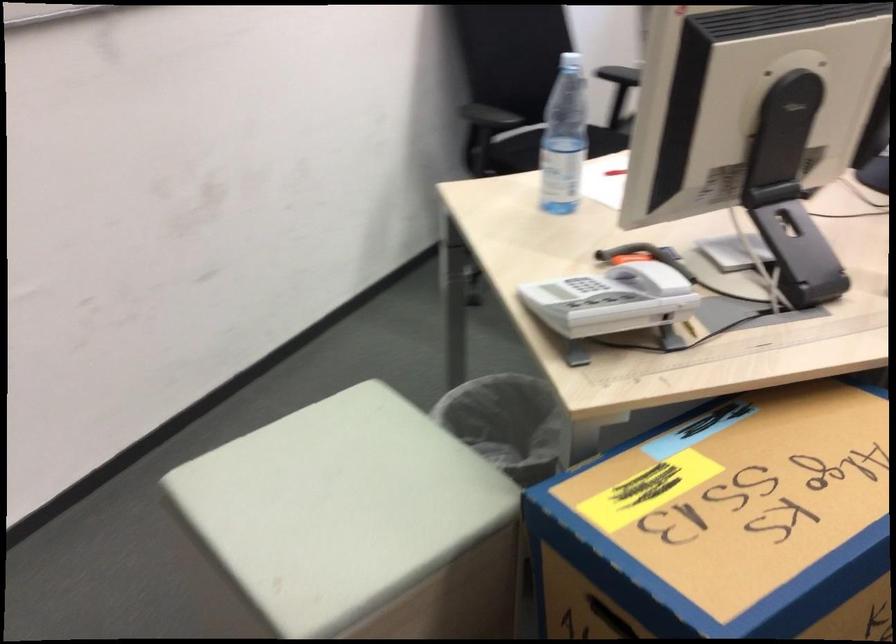
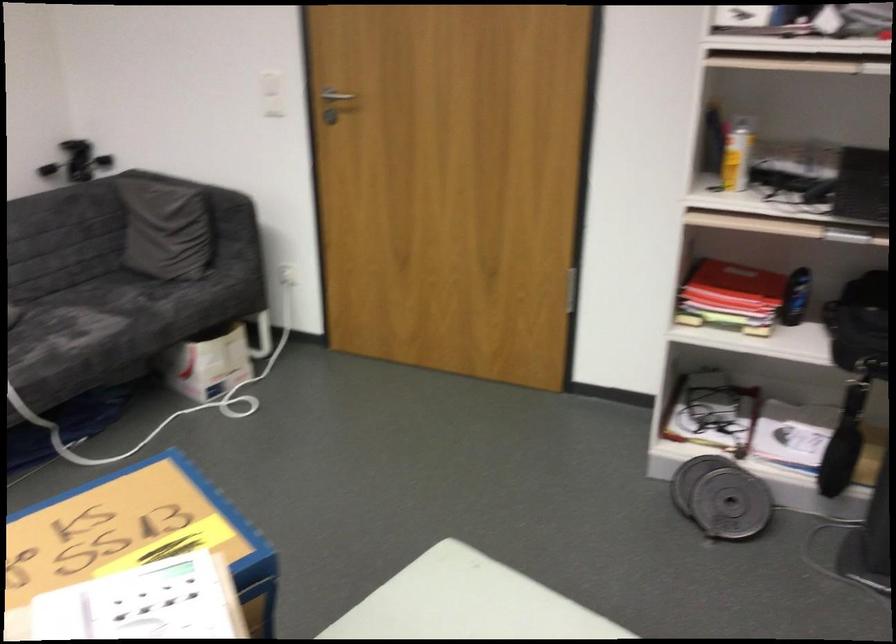
Where in the second image is the point corresponding to point 725,532 from the first image?

(139, 535)